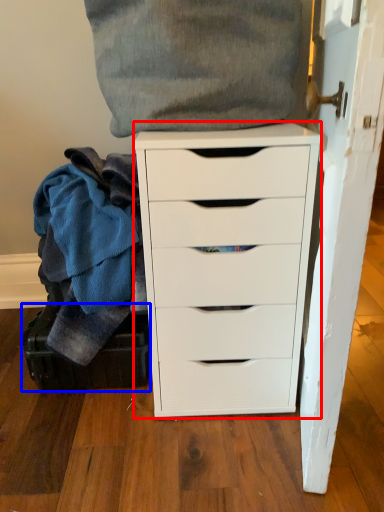
Question: Which point is closer to the camera, chest of drawers (highlighted by a red box) or luggage (highlighted by a blue box)?

Choices:
 (A) chest of drawers
 (B) luggage

Answer: (A)